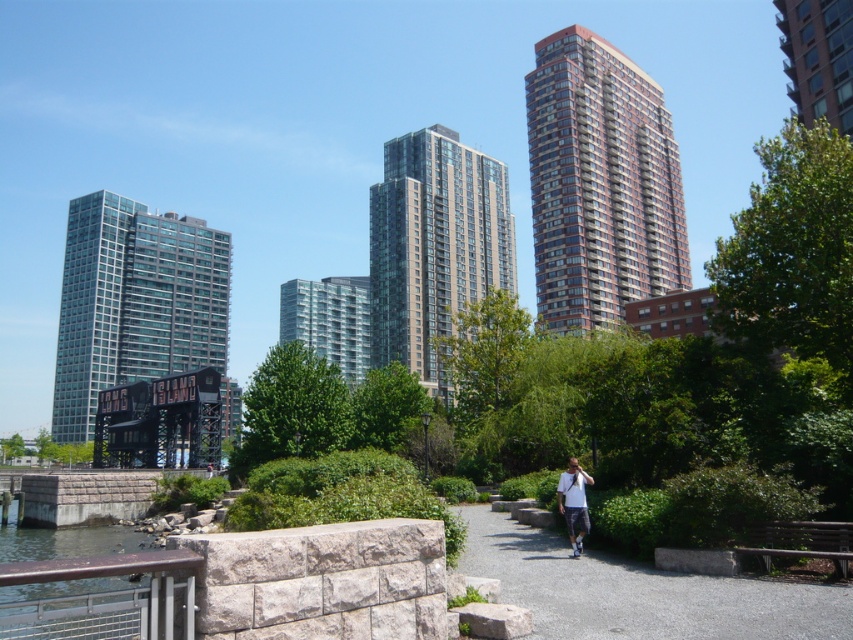
Is reddish-brown glassy building at center-right in front of gray gravel path at center?

No, reddish-brown glassy building at center-right is behind gray gravel path at center.

Who is higher up, reddish-brown glassy building at center-right or gray gravel path at center?

reddish-brown glassy building at center-right is above.

Between point (613, 109) and point (606, 579), which one is positioned behind?

The point (613, 109) is more distant.

Image resolution: width=853 pixels, height=640 pixels. In order to click on reddish-brown glassy building at center-right in this screenshot , I will do `click(601, 182)`.

Who is more forward, (653, 154) or (379, 284)?

Point (653, 154) is more forward.

Can you confirm if reddish-brown glassy building at center-right is positioned above glassy steel building at center?

Yes.

This screenshot has width=853, height=640. What do you see at coordinates (601, 182) in the screenshot?
I see `reddish-brown glassy building at center-right` at bounding box center [601, 182].

The image size is (853, 640). I want to click on reddish-brown glassy building at center-right, so click(x=601, y=182).

Is glassy steel building at center wider than clear glass building at center?

Correct, the width of glassy steel building at center exceeds that of clear glass building at center.

Which is behind, point (412, 280) or point (328, 308)?

Positioned behind is point (328, 308).

I want to click on glassy steel building at center, so click(x=433, y=244).